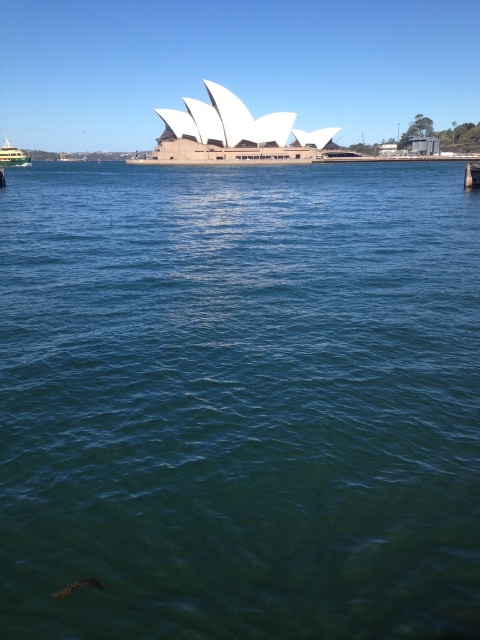
Based on the photo, you are standing on the observation deck of the Sydney Opera House and want to take a photo that includes both the green water at center and the green metallic ferry at left. Which object should you focus on first to ensure both are in the frame?

You should focus on the green metallic ferry at left first because it is further away from the viewer than the green water at center, so adjusting the camera to capture it ensures both are included.

You are a tourist standing on the Sydney Opera House observation deck and want to take a photo of the green metallic ferry at left and the green water at center. Which object should you point your camera towards first to capture both in the frame?

You should point your camera towards the green metallic ferry at left first because the green water at center is positioned to its right, ensuring both are included in the frame.